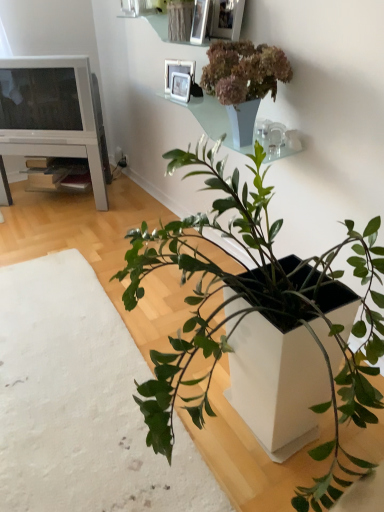
Question: Would you say matte gray vase at upper center, which is counted as the first houseplant, starting from the right, is outside green matte plant at center, which is counted as the 2th houseplant, starting from the right?

Choices:
 (A) yes
 (B) no

Answer: (A)

Question: Considering the relative sizes of matte gray vase at upper center, which is counted as the first houseplant, starting from the right, and green matte plant at center, which is counted as the 2th houseplant, starting from the right, in the image provided, is matte gray vase at upper center, which is counted as the first houseplant, starting from the right, bigger than green matte plant at center, which is counted as the 2th houseplant, starting from the right,?

Choices:
 (A) yes
 (B) no

Answer: (B)

Question: Can green matte plant at center, which is counted as the 2th houseplant, starting from the right, be found inside matte gray vase at upper center, the 2th houseplant when ordered from left to right?

Choices:
 (A) yes
 (B) no

Answer: (B)

Question: Considering the relative sizes of matte gray vase at upper center, which is counted as the first houseplant, starting from the right, and green matte plant at center, acting as the 1th houseplant starting from the left, in the image provided, is matte gray vase at upper center, which is counted as the first houseplant, starting from the right, thinner than green matte plant at center, acting as the 1th houseplant starting from the left,?

Choices:
 (A) yes
 (B) no

Answer: (A)

Question: Does matte gray vase at upper center, which is counted as the first houseplant, starting from the right, have a smaller size compared to green matte plant at center, acting as the 1th houseplant starting from the left?

Choices:
 (A) no
 (B) yes

Answer: (B)

Question: Can you confirm if matte gray vase at upper center, the 2th houseplant when ordered from left to right, is shorter than green matte plant at center, which is counted as the 2th houseplant, starting from the right?

Choices:
 (A) yes
 (B) no

Answer: (B)

Question: Does green matte plant at center, acting as the 1th houseplant starting from the left, turn towards metallic silver picture frame at upper center, the fourth picture frame in the back-to-front sequence?

Choices:
 (A) yes
 (B) no

Answer: (B)

Question: Is green matte plant at center, acting as the 1th houseplant starting from the left, behind metallic silver picture frame at upper center, the first picture frame in the front-to-back sequence?

Choices:
 (A) yes
 (B) no

Answer: (B)

Question: Can you confirm if green matte plant at center, which is counted as the 2th houseplant, starting from the right, is wider than metallic silver picture frame at upper center, the fourth picture frame in the back-to-front sequence?

Choices:
 (A) yes
 (B) no

Answer: (A)

Question: Considering the relative sizes of green matte plant at center, which is counted as the 2th houseplant, starting from the right, and metallic silver picture frame at upper center, the fourth picture frame in the back-to-front sequence, in the image provided, is green matte plant at center, which is counted as the 2th houseplant, starting from the right, taller than metallic silver picture frame at upper center, the fourth picture frame in the back-to-front sequence,?

Choices:
 (A) yes
 (B) no

Answer: (B)

Question: Can you confirm if green matte plant at center, which is counted as the 2th houseplant, starting from the right, is thinner than metallic silver picture frame at upper center, the fourth picture frame in the back-to-front sequence?

Choices:
 (A) no
 (B) yes

Answer: (A)

Question: From a real-world perspective, is green matte plant at center, acting as the 1th houseplant starting from the left, positioned under metallic silver picture frame at upper center, the fourth picture frame in the back-to-front sequence, based on gravity?

Choices:
 (A) yes
 (B) no

Answer: (A)

Question: From a real-world perspective, does white wood entertainment center at left sit lower than white glossy picture frame at upper center, which is counted as the 4th picture frame, starting from the front?

Choices:
 (A) yes
 (B) no

Answer: (A)